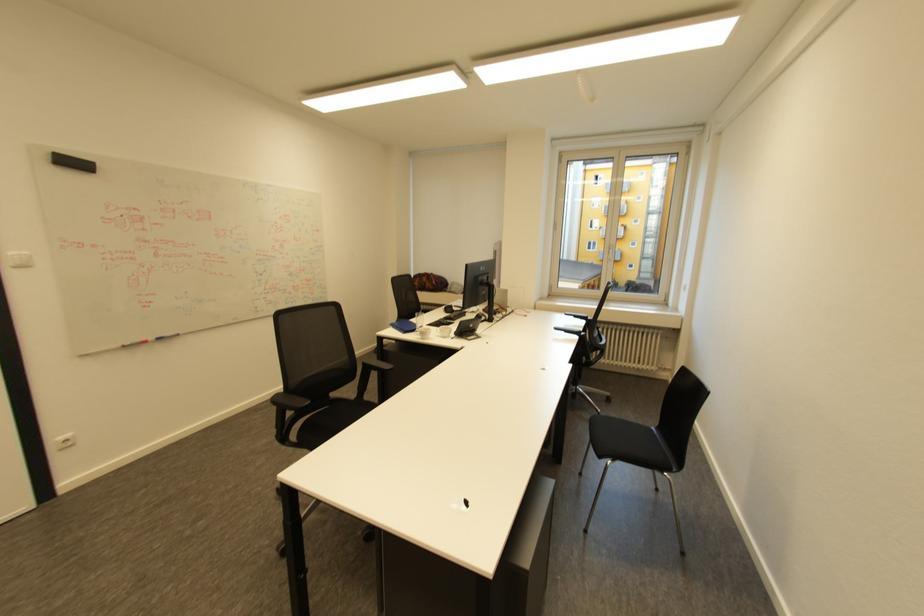
Where is `white light switch`? Image resolution: width=924 pixels, height=616 pixels. white light switch is located at coordinates click(x=19, y=259).